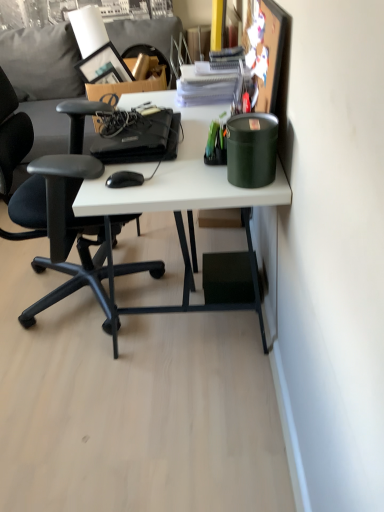
Find the location of a particular element. This screenshot has height=512, width=384. vacant space situated on the left part of white matte desk at center is located at coordinates (55, 313).